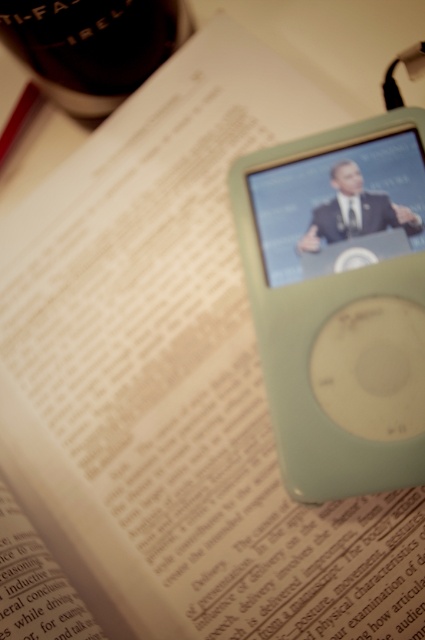
Question: Is light green plastic ipod at center to the right of black glass bottle at top left from the viewer's perspective?

Choices:
 (A) no
 (B) yes

Answer: (B)

Question: Is light green plastic ipod at center further to the viewer compared to black glass bottle at top left?

Choices:
 (A) no
 (B) yes

Answer: (A)

Question: Does light green plastic ipod at center have a lesser width compared to black glass bottle at top left?

Choices:
 (A) yes
 (B) no

Answer: (A)